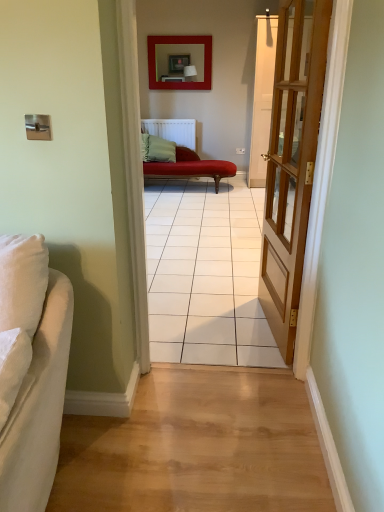
Question: Is white fabric couch at left, the 1th studio couch in the bottom-to-top sequence, to the right of velvet red chaise at center, the 2th studio couch in the front-to-back sequence, from the viewer's perspective?

Choices:
 (A) no
 (B) yes

Answer: (A)

Question: From a real-world perspective, does white fabric couch at left, the 2th studio couch when ordered from top to bottom, sit lower than velvet red chaise at center, the 2th studio couch in the front-to-back sequence?

Choices:
 (A) yes
 (B) no

Answer: (B)

Question: Is white fabric couch at left, the 2th studio couch in the back-to-front sequence, behind velvet red chaise at center, the 1th studio couch positioned from the back?

Choices:
 (A) yes
 (B) no

Answer: (B)

Question: Considering the relative positions of white fabric couch at left, acting as the 1th studio couch starting from the left, and velvet red chaise at center, which is the second studio couch in left-to-right order, in the image provided, is white fabric couch at left, acting as the 1th studio couch starting from the left, to the left of velvet red chaise at center, which is the second studio couch in left-to-right order, from the viewer's perspective?

Choices:
 (A) yes
 (B) no

Answer: (A)

Question: Would you say white fabric couch at left, the first studio couch in the front-to-back sequence, contains velvet red chaise at center, which is the 1th studio couch from top to bottom?

Choices:
 (A) no
 (B) yes

Answer: (A)

Question: From a real-world perspective, is velvet red chaise at center, the 2th studio couch in the front-to-back sequence, physically located above or below white fabric couch at left, acting as the 1th studio couch starting from the left?

Choices:
 (A) above
 (B) below

Answer: (B)

Question: Relative to white fabric couch at left, acting as the 1th studio couch starting from the left, is velvet red chaise at center, the 1th studio couch positioned from the back, in front or behind?

Choices:
 (A) behind
 (B) front

Answer: (A)

Question: From the image's perspective, relative to white fabric couch at left, the 2th studio couch in the back-to-front sequence, is velvet red chaise at center, the 2th studio couch in the front-to-back sequence, above or below?

Choices:
 (A) below
 (B) above

Answer: (B)

Question: In terms of width, does velvet red chaise at center, the 1th studio couch positioned from the back, look wider or thinner when compared to white fabric couch at left, acting as the 1th studio couch starting from the left?

Choices:
 (A) wide
 (B) thin

Answer: (A)

Question: Based on their sizes in the image, would you say velvet red chaise at center, the 1th studio couch positioned from the back, is bigger or smaller than light wood floor at center?

Choices:
 (A) small
 (B) big

Answer: (B)

Question: Which is correct: velvet red chaise at center, which is the second studio couch in left-to-right order, is inside light wood floor at center, or outside of it?

Choices:
 (A) inside
 (B) outside

Answer: (B)

Question: Is velvet red chaise at center, the 1th studio couch positioned from the back, in front of or behind light wood floor at center in the image?

Choices:
 (A) front
 (B) behind

Answer: (B)

Question: From the image's perspective, is velvet red chaise at center, which is the second studio couch in left-to-right order, above or below light wood floor at center?

Choices:
 (A) above
 (B) below

Answer: (A)

Question: Considering the positions of matte red picture frame at upper center and white fabric couch at left, the first studio couch in the front-to-back sequence, in the image, is matte red picture frame at upper center wider or thinner than white fabric couch at left, the first studio couch in the front-to-back sequence,?

Choices:
 (A) wide
 (B) thin

Answer: (B)

Question: Relative to white fabric couch at left, acting as the 1th studio couch starting from the left, is matte red picture frame at upper center in front or behind?

Choices:
 (A) front
 (B) behind

Answer: (B)